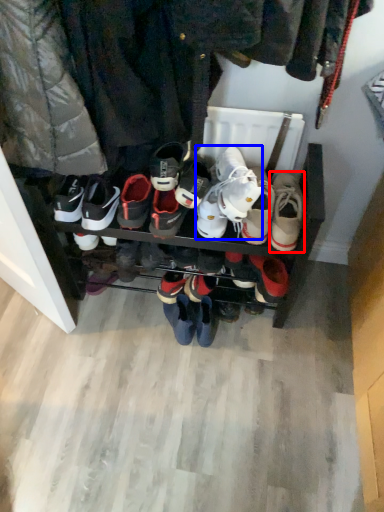
Question: Which point is further to the camera, footwear (highlighted by a red box) or footwear (highlighted by a blue box)?

Choices:
 (A) footwear
 (B) footwear

Answer: (B)